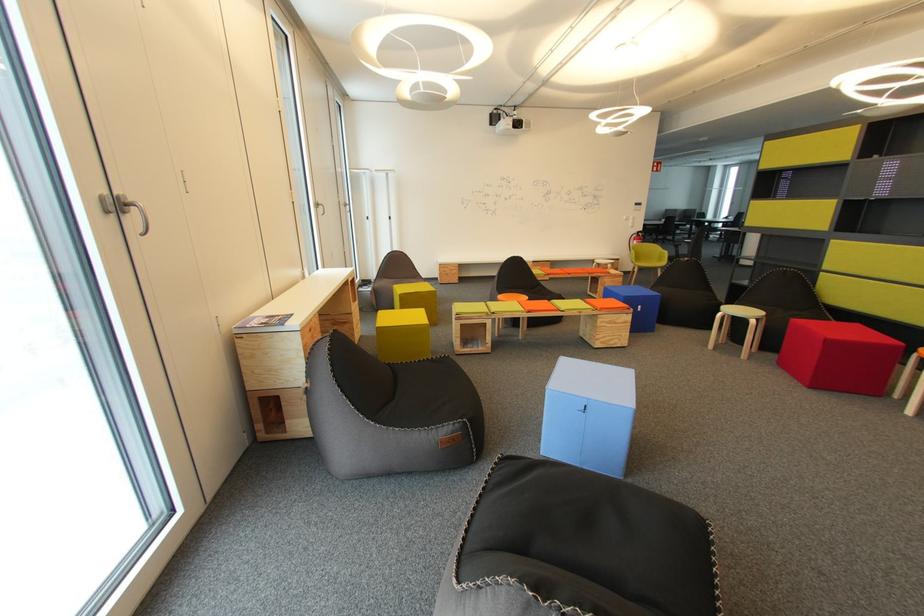
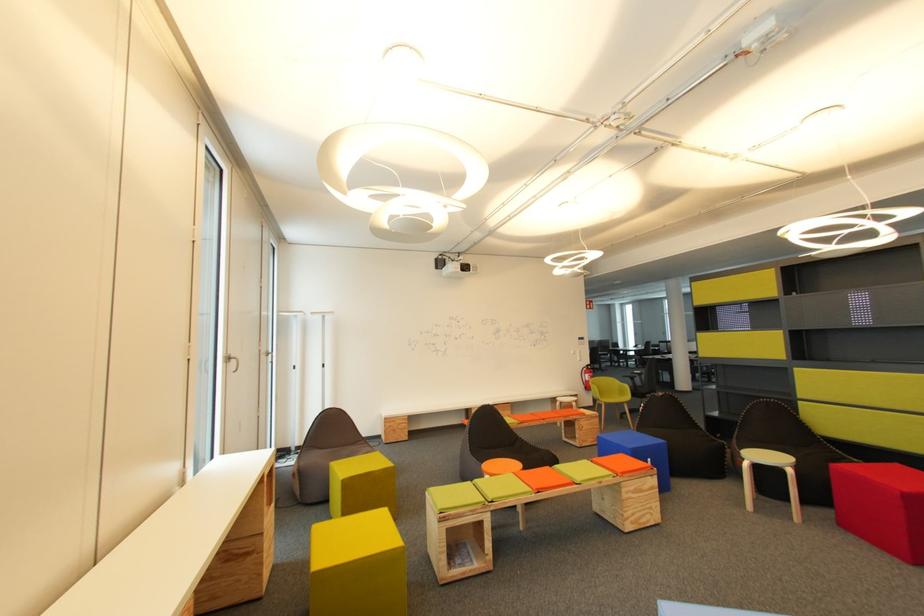
Question: The first image is from the beginning of the video and the second image is from the end. How did the camera likely rotate when shooting the video?

Choices:
 (A) Left
 (B) Right
 (C) Up
 (D) Down

Answer: (C)